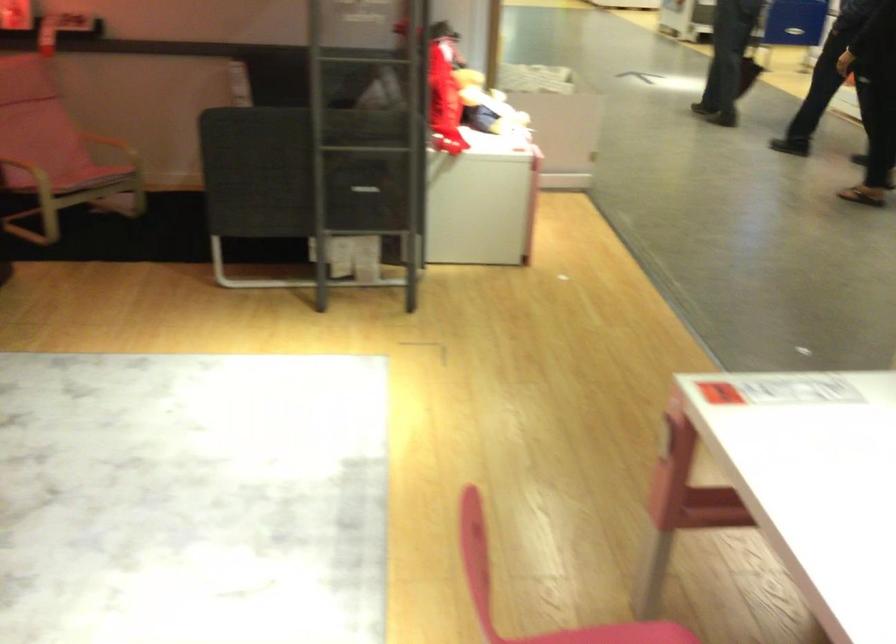
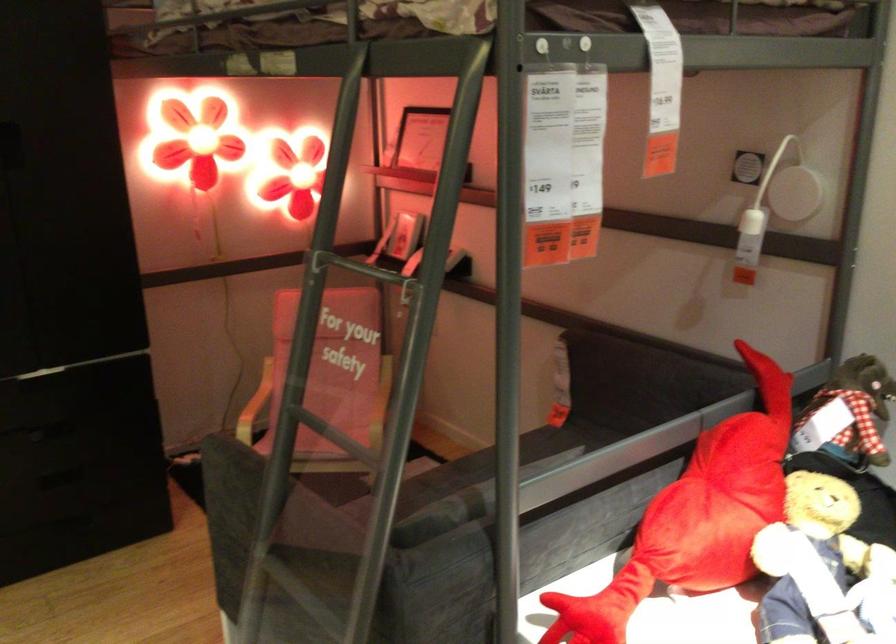
Question: I am providing you with two images of the same scene from different viewpoints. Which of the following objects are not visible in image2?

Choices:
 (A) black drawer handle
 (B) white lamp switch
 (C) dark sofa sitting surface
 (D) none of these

Answer: (D)